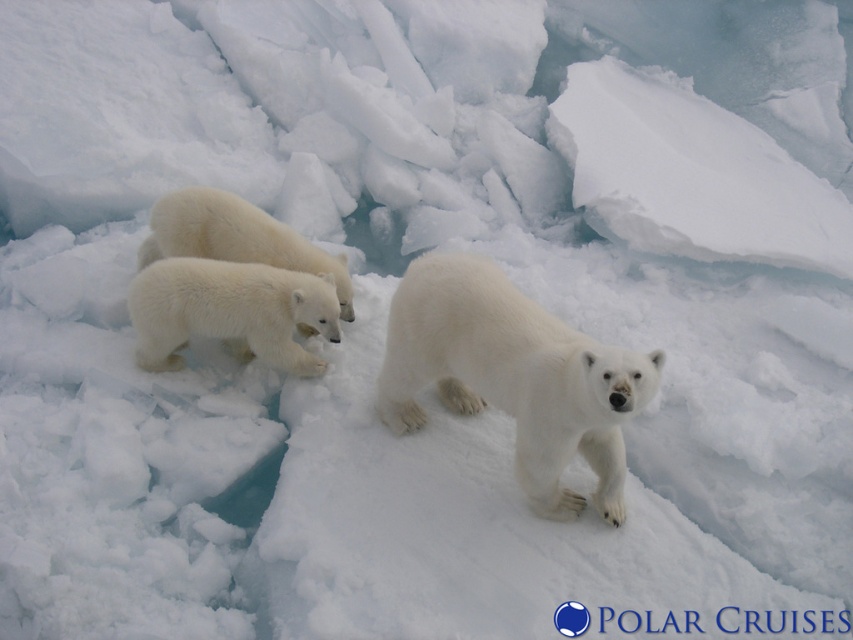
Can you confirm if white fluffy bear cub at left is bigger than white fluffy bear at center?

Actually, white fluffy bear cub at left might be smaller than white fluffy bear at center.

Between point (248, 346) and point (247, 216), which one is positioned in front?

Point (248, 346) is more forward.

Who is more forward, (x=279, y=285) or (x=248, y=230)?

Point (x=279, y=285)

The width and height of the screenshot is (853, 640). In order to click on white fluffy bear cub at left in this screenshot , I will do `click(230, 310)`.

Who is more distant from viewer, (x=416, y=259) or (x=309, y=333)?

The point (x=309, y=333) is behind.

Locate an element on the screen. This screenshot has width=853, height=640. white fur bear at center is located at coordinates (514, 376).

This screenshot has width=853, height=640. Find the location of `white fur bear at center`. white fur bear at center is located at coordinates (514, 376).

Is white fur bear at center further to the viewer compared to white fluffy bear cub at left?

No.

Can you confirm if white fur bear at center is positioned below white fluffy bear cub at left?

Yes.

At what (x,y) coordinates should I click in order to perform the action: click on white fur bear at center. Please return your answer as a coordinate pair (x, y). Looking at the image, I should click on (514, 376).

This screenshot has height=640, width=853. Identify the location of white fur bear at center. (514, 376).